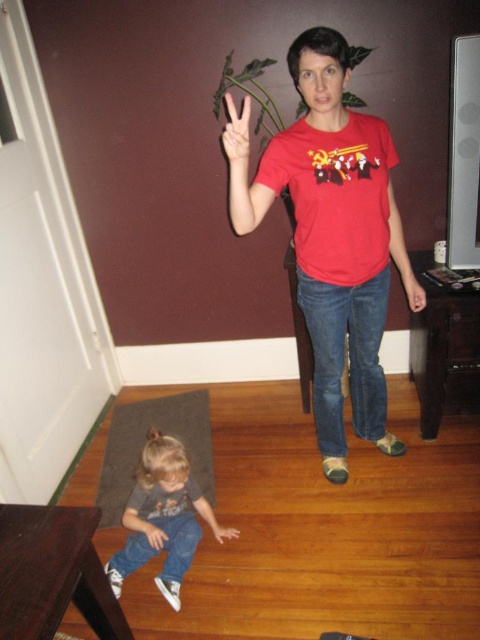
Question: Does matte red t-shirt at center appear on the right side of matte skin hand at center?

Choices:
 (A) no
 (B) yes

Answer: (A)

Question: Where is matte red hand at center located in relation to matte skin hand at center in the image?

Choices:
 (A) right
 (B) left

Answer: (B)

Question: Which object is the closest to the brown carpet at lower left?

Choices:
 (A) matte red hand at center
 (B) matte skin hand at center
 (C) smooth skin hand at lower left

Answer: (C)

Question: Is matte skin hand at center further to camera compared to smooth skin hand at lower center?

Choices:
 (A) no
 (B) yes

Answer: (B)

Question: Which point appears farthest from the camera in this image?

Choices:
 (A) (147, 536)
 (B) (404, 273)
 (C) (205, 422)

Answer: (C)

Question: Which point appears farthest from the camera in this image?

Choices:
 (A) (96, 502)
 (B) (240, 131)
 (C) (369, 241)

Answer: (A)